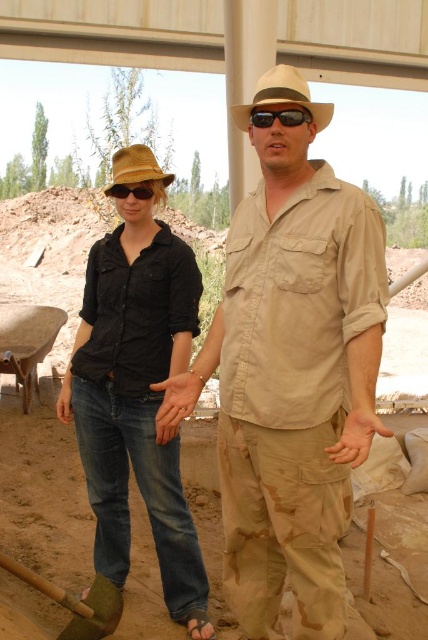
You are standing at the center of the image and want to reach the point marked at coordinates (77,602). Which object should you move towards?

The point marked at coordinates (77,602) is on the wooden shovel at lower left, so you should move towards the wooden shovel at lower left to reach it.